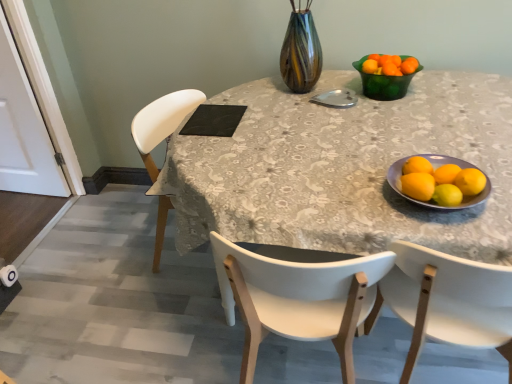
The image size is (512, 384). Find the location of `free space in front of black matte placemat at upper center`. free space in front of black matte placemat at upper center is located at coordinates (212, 139).